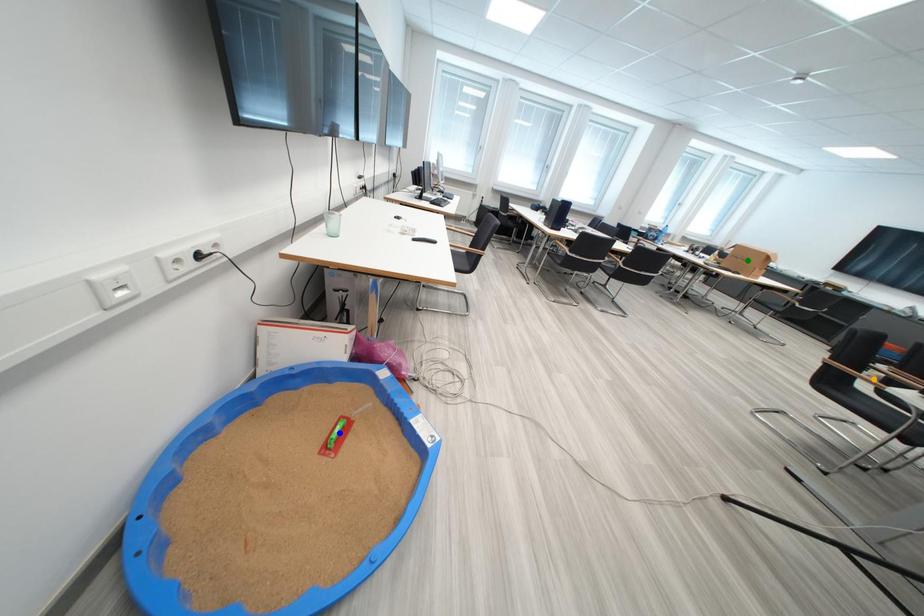
Order these from farthest to nearest:
green point | blue point | orange point

green point, orange point, blue point